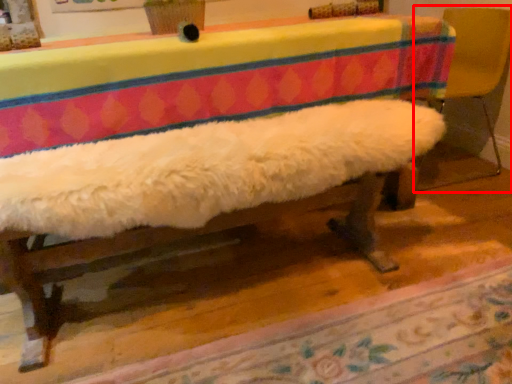
Question: Where is armchair (annotated by the red box) located in relation to mat in the image?

Choices:
 (A) right
 (B) left

Answer: (A)